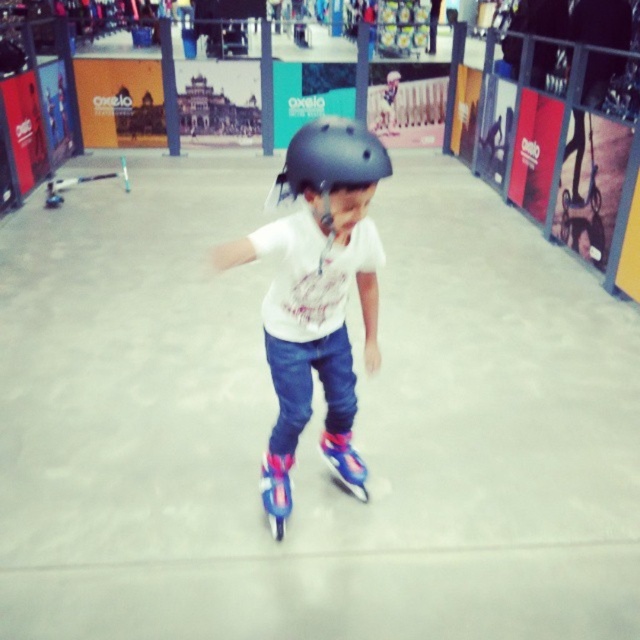
Question: Does black matte helmet at center appear on the left side of pink plastic roller skate at center?

Choices:
 (A) no
 (B) yes

Answer: (A)

Question: Which object is farther from the camera taking this photo?

Choices:
 (A) pink plastic roller skate at center
 (B) pink glossy roller skate at center

Answer: (B)

Question: Can you confirm if matte black helmet at center is positioned to the left of pink plastic roller skate at center?

Choices:
 (A) no
 (B) yes

Answer: (A)

Question: Estimate the real-world distances between objects in this image. Which object is farther from the black matte helmet at center?

Choices:
 (A) pink glossy roller skate at center
 (B) matte black helmet at center
 (C) pink plastic roller skate at center

Answer: (A)

Question: Does pink plastic roller skate at center appear on the right side of pink glossy roller skate at center?

Choices:
 (A) yes
 (B) no

Answer: (B)

Question: Among these objects, which one is nearest to the camera?

Choices:
 (A) pink glossy roller skate at center
 (B) pink plastic roller skate at center

Answer: (B)